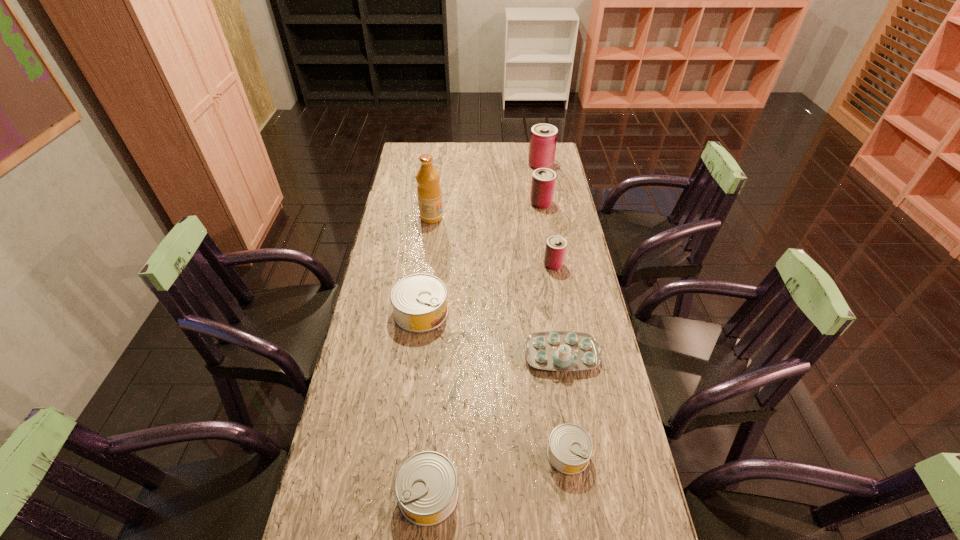
Locate an element on the screen. This screenshot has height=540, width=960. blue chinaware is located at coordinates coord(551,350).

Where is `chinaware`? This screenshot has height=540, width=960. chinaware is located at coordinates point(551,350).

This screenshot has width=960, height=540. Find the location of `the second shortest can`. the second shortest can is located at coordinates (426, 487).

Where is `the second biggest silver can`? the second biggest silver can is located at coordinates (426, 487).

Identify the location of the shortest object. This screenshot has height=540, width=960. (570, 447).

Where is `the smallest silver can`? This screenshot has height=540, width=960. the smallest silver can is located at coordinates (570, 447).

Where is `vacant region located on the front label of the third farthest object`? Image resolution: width=960 pixels, height=540 pixels. vacant region located on the front label of the third farthest object is located at coordinates (526, 218).

This screenshot has height=540, width=960. In order to click on vacant space located on the left of the farthest object in this screenshot , I will do `click(461, 165)`.

Identify the location of vacant space located on the front of the second biggest pink can. This screenshot has width=960, height=540. coord(544,220).

Where is `vacant space located 0.330m on the back of the smallest pink can`? vacant space located 0.330m on the back of the smallest pink can is located at coordinates (543, 205).